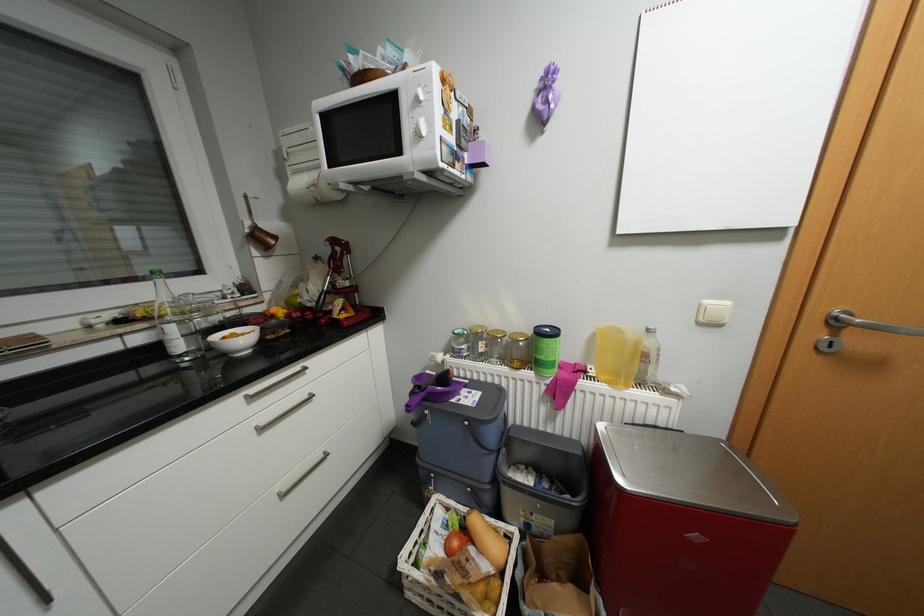
At what (x,y) coordinates should I click in order to perform the action: click on red juicer handle. Please return your answer as a coordinate pair (x, y). Looking at the image, I should click on (337, 275).